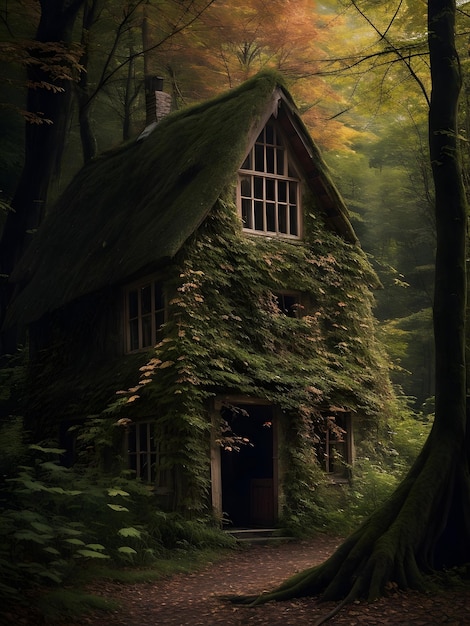
Identify the location of attic room. (269, 193).